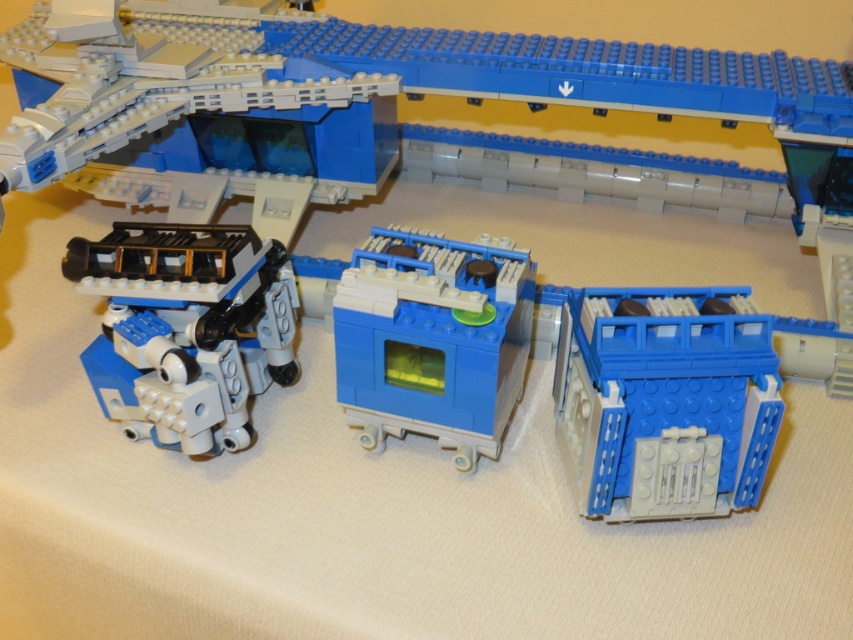
Is matte black robot at lower left positioned at the back of blue plastic machine at center?

Yes, it is.

Who is more distant from viewer, (231, 348) or (451, 326)?

The point (231, 348) is more distant.

Describe the element at coordinates (186, 328) in the screenshot. I see `matte black robot at lower left` at that location.

Find the location of a particular element. This screenshot has width=853, height=640. matte black robot at lower left is located at coordinates (186, 328).

Is blue plastic building at lower right positioned behind matte black robot at lower left?

That is False.

Consider the image. Which is below, blue plastic building at lower right or matte black robot at lower left?

Positioned lower is blue plastic building at lower right.

Image resolution: width=853 pixels, height=640 pixels. I want to click on blue plastic building at lower right, so click(x=664, y=401).

Who is lower down, blue plastic building at lower right or blue plastic machine at center?

Positioned lower is blue plastic building at lower right.

Is blue plastic building at lower right taller than blue plastic machine at center?

No.

Is point (610, 493) closer to viewer compared to point (445, 243)?

Yes, point (610, 493) is in front of point (445, 243).

You are a GUI agent. You are given a task and a screenshot of the screen. Output one action in this format:
    pyautogui.click(x=<x>, y=<y>)
    Task: Click on the blue plastic building at lower right
    The image size is (853, 640).
    Given the screenshot: What is the action you would take?
    pyautogui.click(x=664, y=401)